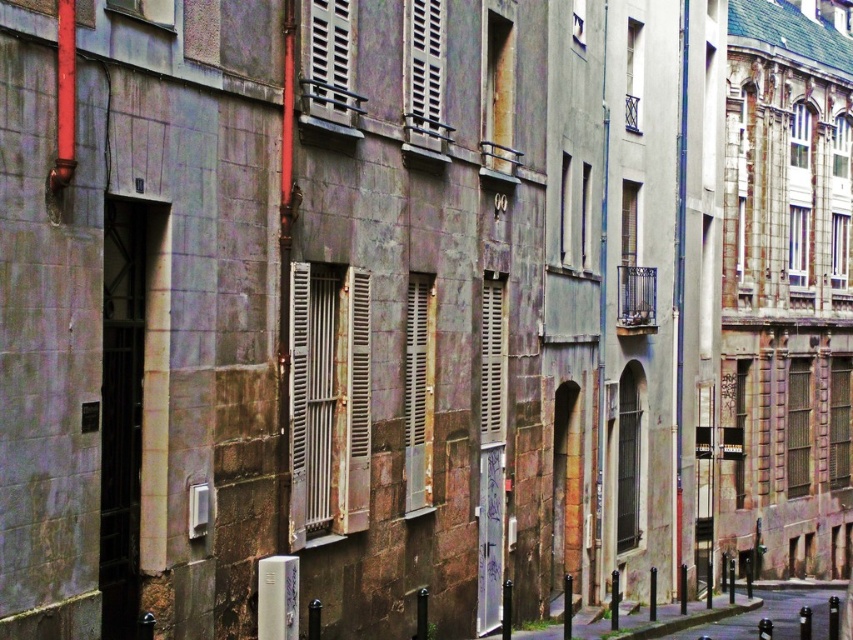
Does wooden slats at center appear over brown wooden shutter at right?

Yes.

Can you confirm if wooden slats at center is positioned to the left of brown wooden shutter at right?

Indeed, wooden slats at center is positioned on the left side of brown wooden shutter at right.

The width and height of the screenshot is (853, 640). In order to click on wooden slats at center in this screenshot , I will do `click(492, 362)`.

Where is `wooden slats at center`? Image resolution: width=853 pixels, height=640 pixels. wooden slats at center is located at coordinates (492, 362).

Which is in front, point (405, 490) or point (628, 365)?

Positioned in front is point (405, 490).

Is white painted wood shutter at center taller than metallic silver shutter at center?

In fact, white painted wood shutter at center may be shorter than metallic silver shutter at center.

Who is more forward, (x=430, y=317) or (x=633, y=436)?

Positioned in front is point (x=430, y=317).

I want to click on white painted wood shutter at center, so click(418, 392).

Does rusty metal shutter at center have a larger size compared to white wooden shutter at center?

Yes, rusty metal shutter at center is bigger than white wooden shutter at center.

Who is higher up, rusty metal shutter at center or white wooden shutter at center?

rusty metal shutter at center is higher up.

Who is more forward, (318, 470) or (840, 465)?

Positioned in front is point (318, 470).

You are a GUI agent. You are given a task and a screenshot of the screen. Output one action in this format:
    pyautogui.click(x=<x>, y=<y>)
    Task: Click on the rusty metal shutter at center
    This screenshot has height=640, width=853.
    Given the screenshot: What is the action you would take?
    pyautogui.click(x=328, y=401)